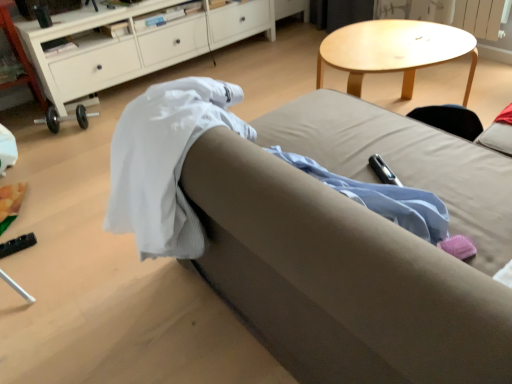
The width and height of the screenshot is (512, 384). I want to click on white wood cabinet at upper left, so click(x=135, y=42).

What do you see at coordinates (135, 42) in the screenshot? This screenshot has width=512, height=384. I see `white wood cabinet at upper left` at bounding box center [135, 42].

Measure the distance between point (114, 77) and camera.

9.17 feet.

Locate an element on the screen. The height and width of the screenshot is (384, 512). light brown fabric couch at center is located at coordinates (340, 278).

Describe the element at coordinates (340, 278) in the screenshot. I see `light brown fabric couch at center` at that location.

This screenshot has height=384, width=512. Identify the location of white wood cabinet at upper left. (135, 42).

Between light brown fabric couch at center and white wood cabinet at upper left, which one appears on the right side from the viewer's perspective?

Positioned to the right is light brown fabric couch at center.

Relative to white wood cabinet at upper left, is light brown fabric couch at center in front or behind?

In the image, light brown fabric couch at center appears in front of white wood cabinet at upper left.

Is point (283, 277) in front of point (169, 44)?

That is True.

From the image's perspective, which is below, light brown fabric couch at center or white wood cabinet at upper left?

From the image's view, light brown fabric couch at center is below.

From a real-world perspective, is light brown fabric couch at center located beneath white wood cabinet at upper left?

No, from a real-world perspective, light brown fabric couch at center is not under white wood cabinet at upper left.

Does light brown fabric couch at center have a lesser width compared to white wood cabinet at upper left?

No, light brown fabric couch at center is not thinner than white wood cabinet at upper left.

Can you confirm if light brown fabric couch at center is taller than white wood cabinet at upper left?

Yes.

In terms of size, does light brown fabric couch at center appear bigger or smaller than white wood cabinet at upper left?

Considering their sizes, light brown fabric couch at center takes up more space than white wood cabinet at upper left.

Is light brown fabric couch at center inside or outside of white wood cabinet at upper left?

light brown fabric couch at center is not enclosed by white wood cabinet at upper left.

Would you say light brown fabric couch at center is a long distance from white wood cabinet at upper left?

light brown fabric couch at center is far away from white wood cabinet at upper left.

Is light brown fabric couch at center oriented towards white wood cabinet at upper left?

No, light brown fabric couch at center is not aimed at white wood cabinet at upper left.

How many degrees apart are the facing directions of light brown fabric couch at center and white wood cabinet at upper left?

89.8 degrees.

The height and width of the screenshot is (384, 512). I want to click on studio couch to the right of white wood cabinet at upper left, so click(340, 278).

Visually, is white wood cabinet at upper left positioned to the left or to the right of light brown fabric couch at center?

white wood cabinet at upper left is positioned on light brown fabric couch at center's left side.

Is white wood cabinet at upper left positioned behind light brown fabric couch at center?

Yes.

Considering the positions of points (202, 42) and (283, 318), is point (202, 42) farther from camera compared to point (283, 318)?

Yes, point (202, 42) is behind point (283, 318).

From the image's perspective, which is above, white wood cabinet at upper left or light brown fabric couch at center?

white wood cabinet at upper left.

From a real-world perspective, between white wood cabinet at upper left and light brown fabric couch at center, who is vertically higher?

light brown fabric couch at center is physically above.

Which of these two, white wood cabinet at upper left or light brown fabric couch at center, is thinner?

white wood cabinet at upper left.

Which of these two, white wood cabinet at upper left or light brown fabric couch at center, stands taller?

light brown fabric couch at center.

Is white wood cabinet at upper left smaller than light brown fabric couch at center?

Correct, white wood cabinet at upper left occupies less space than light brown fabric couch at center.

Is light brown fabric couch at center surrounded by white wood cabinet at upper left?

No, white wood cabinet at upper left does not contain light brown fabric couch at center.

Are white wood cabinet at upper left and light brown fabric couch at center far apart?

white wood cabinet at upper left is far away from light brown fabric couch at center.

Is white wood cabinet at upper left oriented away from light brown fabric couch at center?

white wood cabinet at upper left does not have its back to light brown fabric couch at center.

How different are the orientations of white wood cabinet at upper left and light brown fabric couch at center in degrees?

The facing directions of white wood cabinet at upper left and light brown fabric couch at center are 89.8 degrees apart.

Find the location of a particular element. The height and width of the screenshot is (384, 512). studio couch that appears above the white wood cabinet at upper left (from a real-world perspective) is located at coordinates (340, 278).

The image size is (512, 384). I want to click on cabinetry located behind the light brown fabric couch at center, so click(135, 42).

Identify the location of cabinetry on the left side of light brown fabric couch at center. (135, 42).